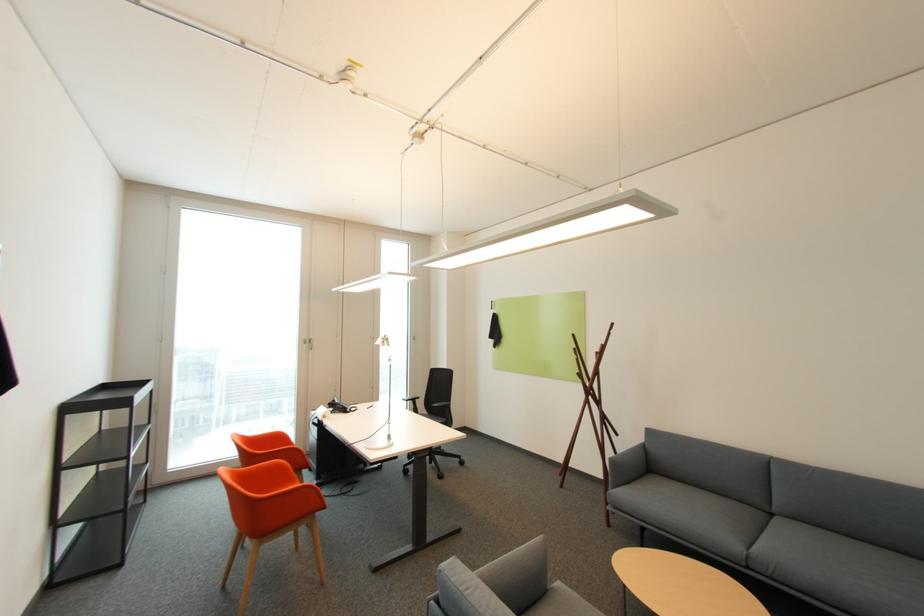
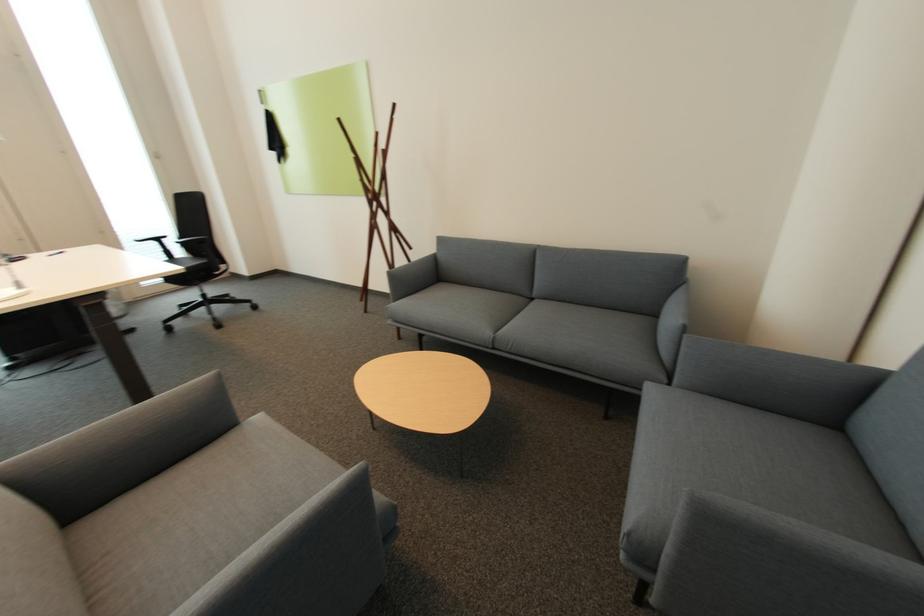
The point at (549, 537) is marked in the first image. Where is the corresponding point in the second image?

(219, 373)